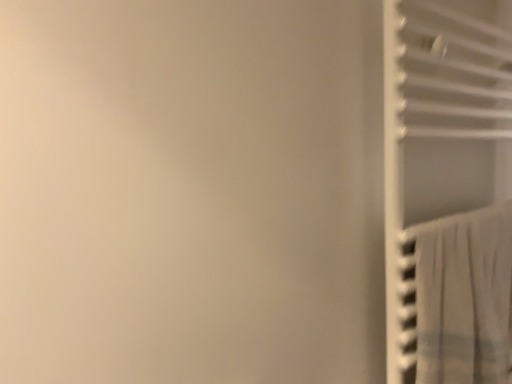
Question: Is white sheer curtain at right completely or partially inside white plastic closet at right?

Choices:
 (A) yes
 (B) no

Answer: (A)

Question: Can you confirm if white plastic closet at right is shorter than white sheer curtain at right?

Choices:
 (A) no
 (B) yes

Answer: (A)

Question: Is white plastic closet at right positioned with its back to white sheer curtain at right?

Choices:
 (A) yes
 (B) no

Answer: (A)

Question: From the image's perspective, is white plastic closet at right on top of white sheer curtain at right?

Choices:
 (A) yes
 (B) no

Answer: (A)

Question: Is white plastic closet at right far away from white sheer curtain at right?

Choices:
 (A) no
 (B) yes

Answer: (A)

Question: Could you tell me if white plastic closet at right is facing white sheer curtain at right?

Choices:
 (A) yes
 (B) no

Answer: (A)

Question: Considering the relative sizes of white sheer curtain at right and white plastic closet at right in the image provided, is white sheer curtain at right thinner than white plastic closet at right?

Choices:
 (A) yes
 (B) no

Answer: (A)

Question: Does white sheer curtain at right have a smaller size compared to white plastic closet at right?

Choices:
 (A) no
 (B) yes

Answer: (B)

Question: Is white sheer curtain at right positioned before white plastic closet at right?

Choices:
 (A) no
 (B) yes

Answer: (A)

Question: Does white sheer curtain at right have a larger size compared to white plastic closet at right?

Choices:
 (A) no
 (B) yes

Answer: (A)

Question: Can you confirm if white sheer curtain at right is shorter than white plastic closet at right?

Choices:
 (A) no
 (B) yes

Answer: (B)

Question: From a real-world perspective, is white sheer curtain at right physically above white plastic closet at right?

Choices:
 (A) yes
 (B) no

Answer: (B)

Question: In terms of height, does white plastic closet at right look taller or shorter compared to white sheer curtain at right?

Choices:
 (A) short
 (B) tall

Answer: (B)